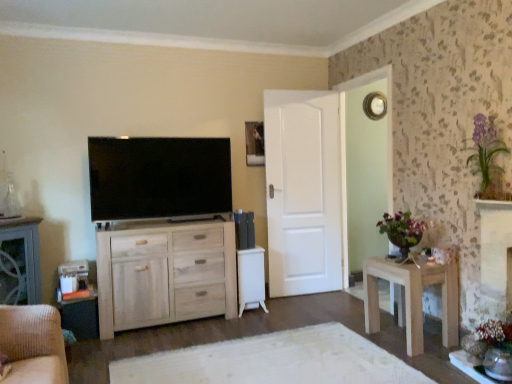
Question: Considering the relative sizes of natural wood cabinet at center and purple glass vase at upper right in the image provided, is natural wood cabinet at center wider than purple glass vase at upper right?

Choices:
 (A) no
 (B) yes

Answer: (B)

Question: From the image's perspective, would you say natural wood cabinet at center is positioned over purple glass vase at upper right?

Choices:
 (A) no
 (B) yes

Answer: (A)

Question: Can purple glass vase at upper right be found inside natural wood cabinet at center?

Choices:
 (A) no
 (B) yes

Answer: (A)

Question: Does natural wood cabinet at center have a greater height compared to purple glass vase at upper right?

Choices:
 (A) no
 (B) yes

Answer: (B)

Question: Considering the relative sizes of natural wood cabinet at center and purple glass vase at upper right in the image provided, is natural wood cabinet at center thinner than purple glass vase at upper right?

Choices:
 (A) yes
 (B) no

Answer: (B)

Question: Does point (486, 122) appear closer or farther from the camera than point (246, 142)?

Choices:
 (A) closer
 (B) farther

Answer: (A)

Question: From the image's perspective, relative to matte black picture frame at upper center, is purple glass vase at upper right above or below?

Choices:
 (A) below
 (B) above

Answer: (A)

Question: In terms of height, does purple glass vase at upper right look taller or shorter compared to matte black picture frame at upper center?

Choices:
 (A) tall
 (B) short

Answer: (A)

Question: Is purple glass vase at upper right in front of or behind matte black picture frame at upper center in the image?

Choices:
 (A) behind
 (B) front

Answer: (B)

Question: Considering the positions of white matte door at center and matte black picture frame at upper center in the image, is white matte door at center wider or thinner than matte black picture frame at upper center?

Choices:
 (A) wide
 (B) thin

Answer: (A)

Question: From a real-world perspective, is white matte door at center physically located above or below matte black picture frame at upper center?

Choices:
 (A) below
 (B) above

Answer: (A)

Question: Based on their positions, is white matte door at center located to the left or right of matte black picture frame at upper center?

Choices:
 (A) left
 (B) right

Answer: (B)

Question: Considering their positions, is white matte door at center located in front of or behind matte black picture frame at upper center?

Choices:
 (A) behind
 (B) front

Answer: (B)

Question: Is point (483, 173) positioned closer to the camera than point (408, 289)?

Choices:
 (A) closer
 (B) farther

Answer: (B)

Question: Considering the positions of purple glass vase at upper right and light wood table at right in the image, is purple glass vase at upper right taller or shorter than light wood table at right?

Choices:
 (A) short
 (B) tall

Answer: (A)